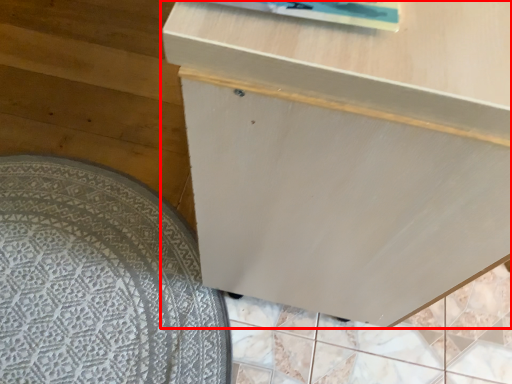
Question: From the image's perspective, considering the relative positions of furniture (annotated by the red box) and mat in the image provided, where is furniture (annotated by the red box) located with respect to the staircase?

Choices:
 (A) above
 (B) below

Answer: (A)